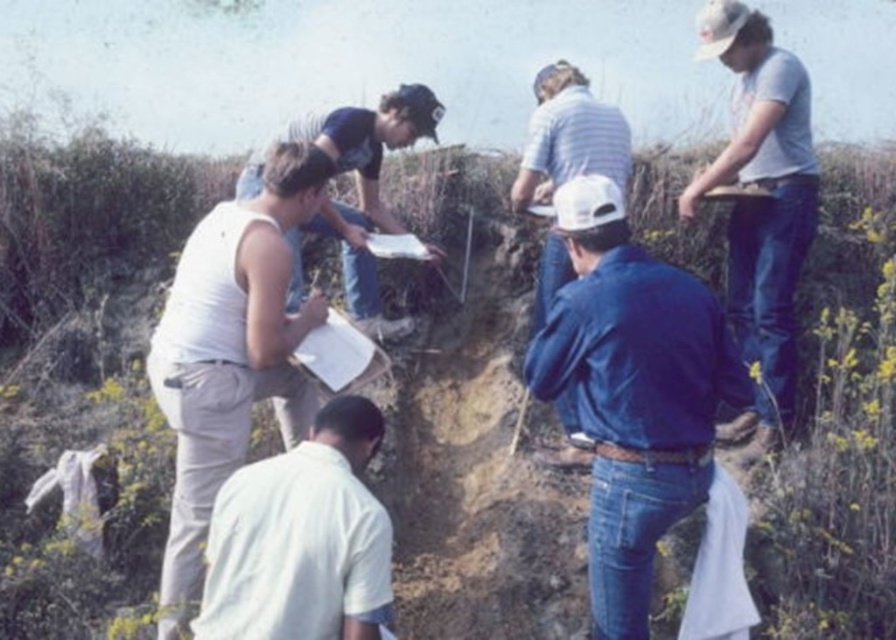
Can you confirm if white cotton shirt at upper right is positioned to the left of white striped shirt at center?

Incorrect, white cotton shirt at upper right is not on the left side of white striped shirt at center.

What do you see at coordinates (760, 205) in the screenshot? I see `white cotton shirt at upper right` at bounding box center [760, 205].

This screenshot has height=640, width=896. In order to click on white cotton shirt at upper right in this screenshot , I will do `click(760, 205)`.

Is blue denim jeans at center shorter than white cotton shirt at lower center?

Incorrect, blue denim jeans at center's height does not fall short of white cotton shirt at lower center's.

Which is in front, point (679, 365) or point (352, 413)?

Point (679, 365) is in front.

This screenshot has height=640, width=896. I want to click on blue denim jeans at center, so click(632, 392).

Does white cotton shirt at upper right appear over white paper at center?

Actually, white cotton shirt at upper right is below white paper at center.

Does white cotton shirt at upper right lie behind white paper at center?

No, white cotton shirt at upper right is closer to the viewer.

Does point (731, 125) lie in front of point (399, 92)?

Yes, point (731, 125) is closer to viewer.

Image resolution: width=896 pixels, height=640 pixels. Find the location of `white cotton shirt at upper right`. white cotton shirt at upper right is located at coordinates (760, 205).